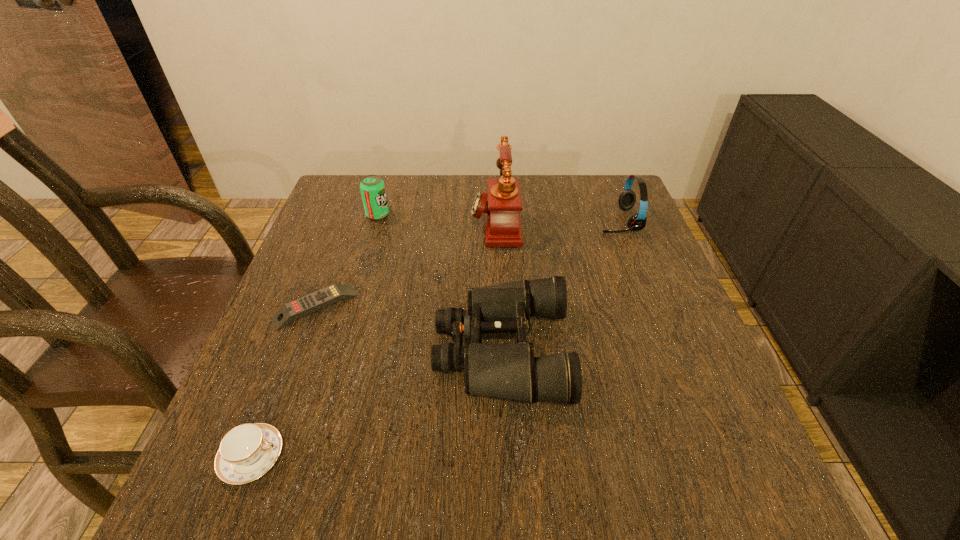
Identify which object is located as the nearest to the third shortest object. Please provide its 2D coordinates. Your answer should be formatted as a tuple, i.e. [(x, y)], where the tuple contains the x and y coordinates of a point satisfying the conditions above.

[(503, 228)]

You are a GUI agent. You are given a task and a screenshot of the screen. Output one action in this format:
    pyautogui.click(x=<x>, y=<y>)
    Task: Click on the object that can be found as the closest to the headset
    The height and width of the screenshot is (540, 960).
    Given the screenshot: What is the action you would take?
    pyautogui.click(x=503, y=228)